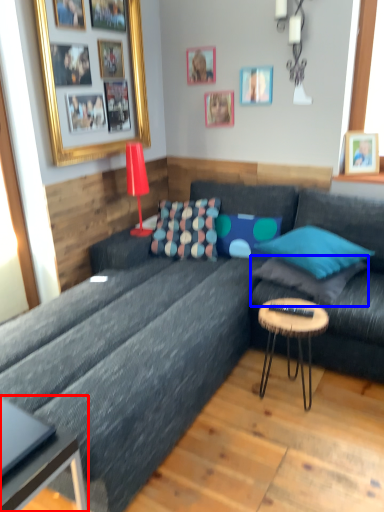
Question: Which of the following is the farthest to the observer, coffee table (highlighted by a red box) or pillow (highlighted by a blue box)?

Choices:
 (A) coffee table
 (B) pillow

Answer: (B)